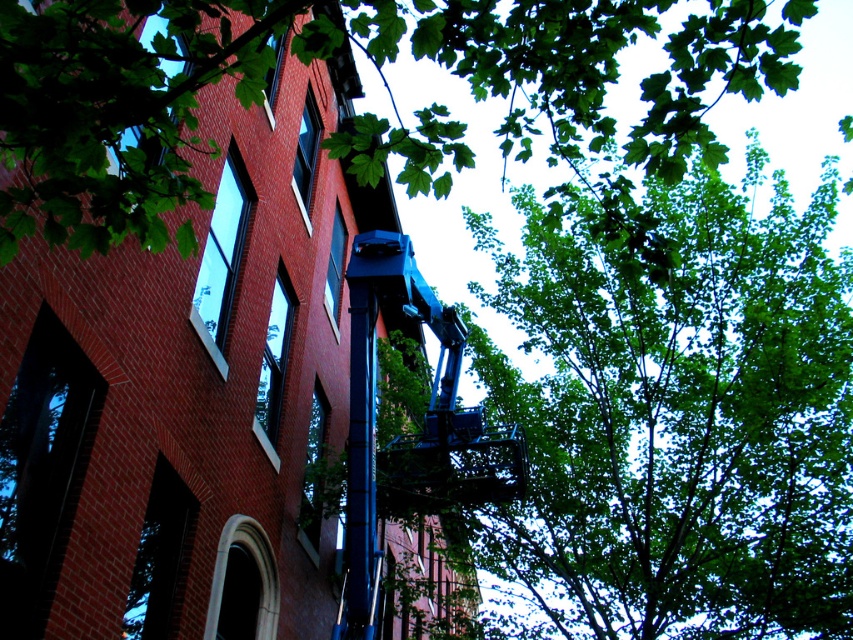
Who is more forward, (799, 552) or (436, 141)?

Point (436, 141) is in front.

Who is higher up, green leafy tree at upper right or green leafy tree at upper center?

green leafy tree at upper center is above.

Does point (730, 362) come farther from viewer compared to point (171, 221)?

Yes.

I want to click on green leafy tree at upper right, so click(675, 408).